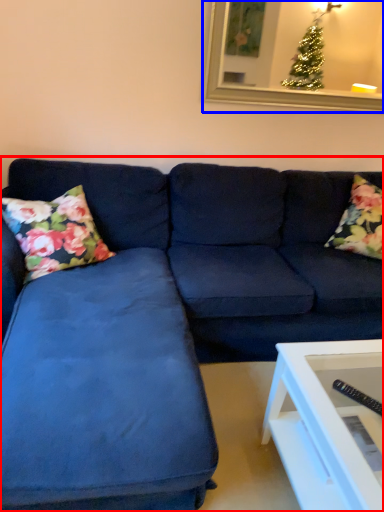
Question: Which object is further to the camera taking this photo, studio couch (highlighted by a red box) or picture frame (highlighted by a blue box)?

Choices:
 (A) studio couch
 (B) picture frame

Answer: (B)